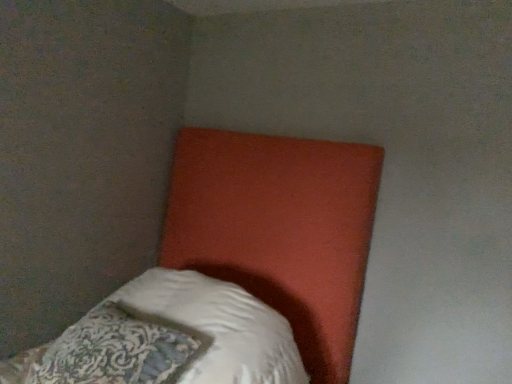
Question: Looking at the image, does white soft pillow at lower left seem bigger or smaller compared to matte orange headboard at upper center?

Choices:
 (A) big
 (B) small

Answer: (B)

Question: From a real-world perspective, is white soft pillow at lower left positioned above or below matte orange headboard at upper center?

Choices:
 (A) below
 (B) above

Answer: (A)

Question: Is point (79, 369) closer or farther from the camera than point (357, 238)?

Choices:
 (A) closer
 (B) farther

Answer: (A)

Question: From a real-world perspective, is matte orange headboard at upper center positioned above or below white soft pillow at lower left?

Choices:
 (A) below
 (B) above

Answer: (B)

Question: Is matte orange headboard at upper center in front of or behind white soft pillow at lower left in the image?

Choices:
 (A) behind
 (B) front

Answer: (B)

Question: In terms of size, does matte orange headboard at upper center appear bigger or smaller than white soft pillow at lower left?

Choices:
 (A) big
 (B) small

Answer: (A)

Question: From the image's perspective, is matte orange headboard at upper center above or below white soft pillow at lower left?

Choices:
 (A) above
 (B) below

Answer: (A)